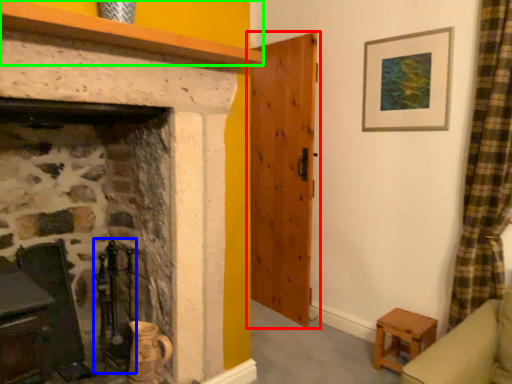
Question: Estimate the real-world distances between objects in this image. Which object is farther from door (highlighted by a red box), chair (highlighted by a blue box) or mantle (highlighted by a green box)?

Choices:
 (A) chair
 (B) mantle

Answer: (B)